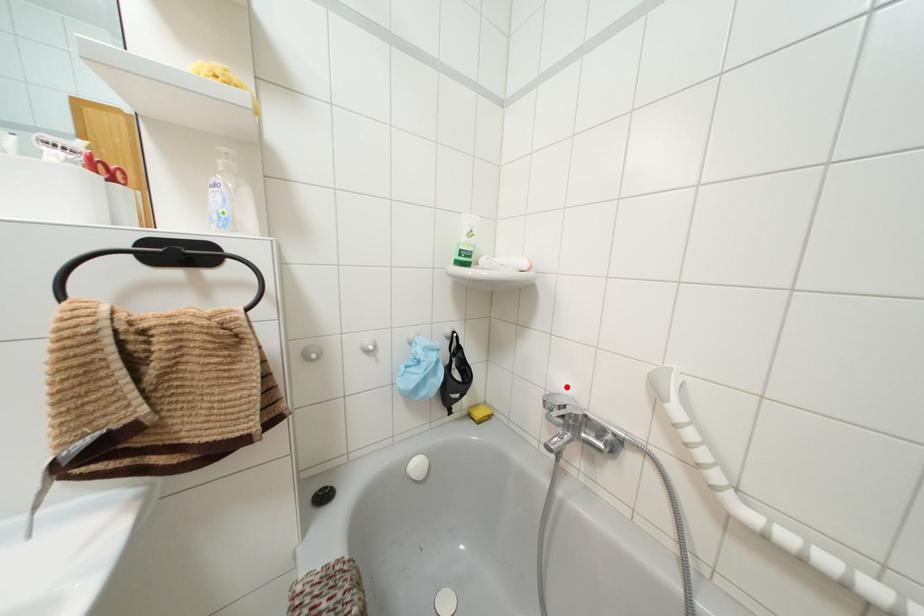
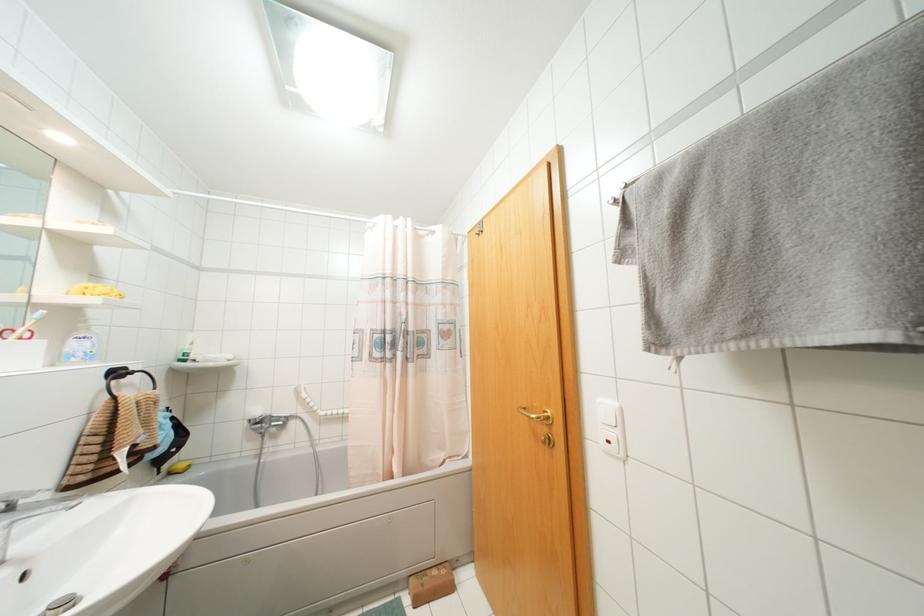
In the second image, find the point that corresponds to the highlighted location in the first image.

(258, 411)